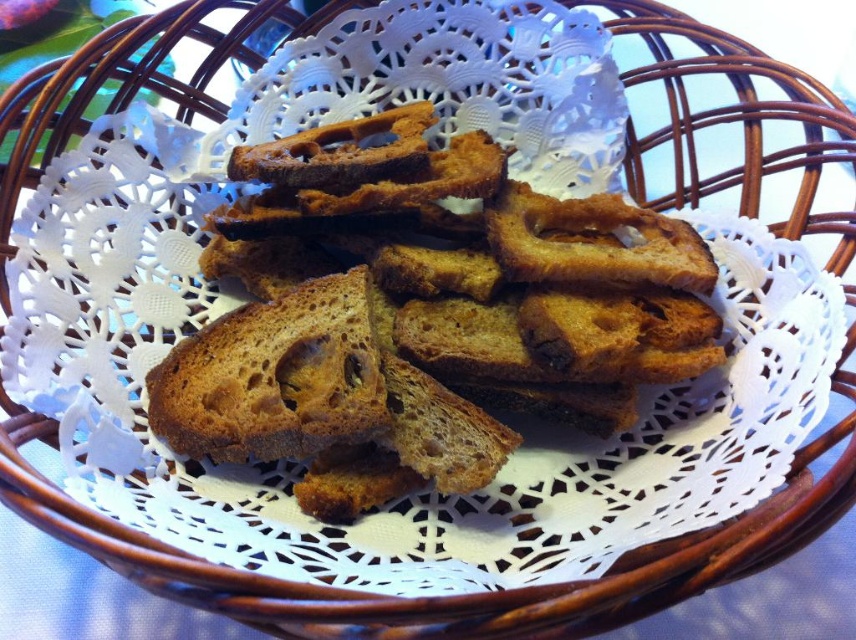
Which is more to the right, brown crumbly bread at center or dark brown crumbly bread at center?

From the viewer's perspective, brown crumbly bread at center appears more on the right side.

Which is above, brown crumbly bread at center or dark brown crumbly bread at center?

brown crumbly bread at center is higher up.

The image size is (856, 640). What are the coordinates of `brown crumbly bread at center` in the screenshot? It's located at (421, 316).